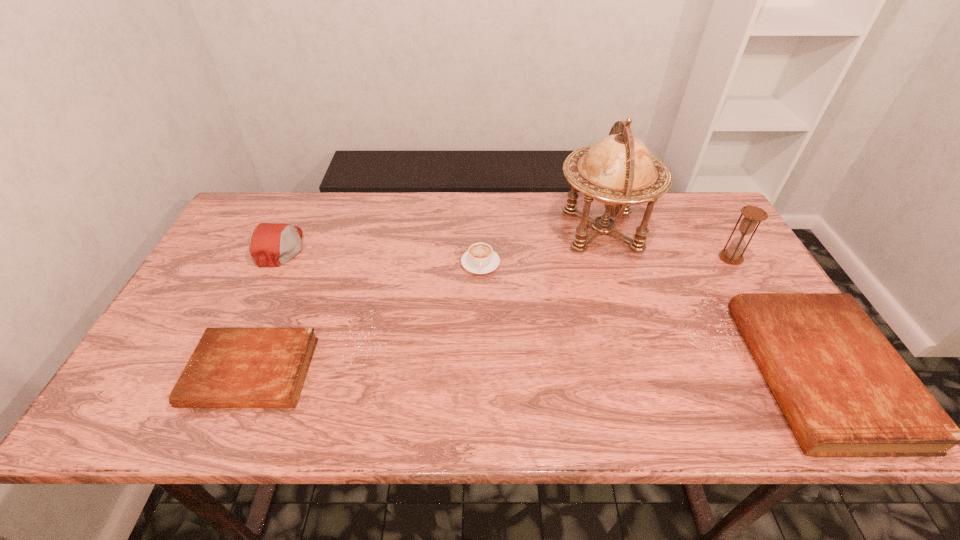
This screenshot has width=960, height=540. I want to click on cap that is at the left edge, so click(x=270, y=244).

Locate an element on the screen. Bible that is positioned at the right edge is located at coordinates (845, 391).

Identify the location of hourglass located in the right edge section of the desktop. (752, 215).

What are the coordinates of `object present at the far left corner` in the screenshot? It's located at (270, 244).

Image resolution: width=960 pixels, height=540 pixels. Identify the location of object located in the near left corner section of the desktop. (230, 367).

Find the location of `object that is at the near right corner`. object that is at the near right corner is located at coordinates (845, 391).

The width and height of the screenshot is (960, 540). I want to click on vacant region at the far edge of the desktop, so click(x=490, y=196).

In the image, there is a desktop. At what (x,y) coordinates should I click in order to perform the action: click on free region at the near edge. Please return your answer as a coordinate pair (x, y). This screenshot has width=960, height=540. Looking at the image, I should click on (396, 380).

I want to click on free space at the right edge of the desktop, so click(x=739, y=270).

The image size is (960, 540). Identify the location of free spot at the far right corner of the desktop. (677, 222).